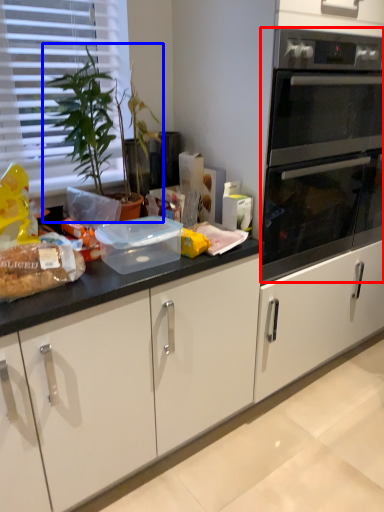
Question: Which point is further to the camera, oven (highlighted by a red box) or houseplant (highlighted by a blue box)?

Choices:
 (A) oven
 (B) houseplant

Answer: (A)